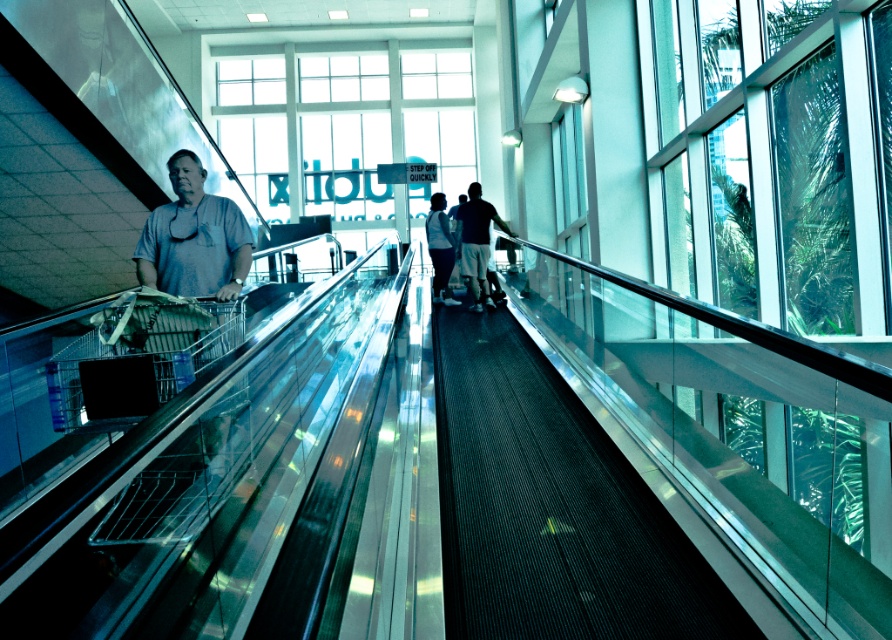
Question: Which of the following is the closest to the observer?

Choices:
 (A) light blue jeans at center
 (B) dark blue shorts at center
 (C) gray matte shirt at center

Answer: (C)

Question: Among these points, which one is farthest from the camera?

Choices:
 (A) (458, 246)
 (B) (434, 257)
 (C) (154, 212)

Answer: (B)

Question: Where is dark blue shorts at center located in relation to light blue jeans at center in the image?

Choices:
 (A) left
 (B) right

Answer: (B)

Question: Which point appears closest to the camera in this image?

Choices:
 (A) (175, 280)
 (B) (442, 259)

Answer: (A)

Question: Is dark blue shorts at center in front of light blue jeans at center?

Choices:
 (A) yes
 (B) no

Answer: (A)

Question: Does dark blue shorts at center appear on the right side of light blue jeans at center?

Choices:
 (A) yes
 (B) no

Answer: (A)